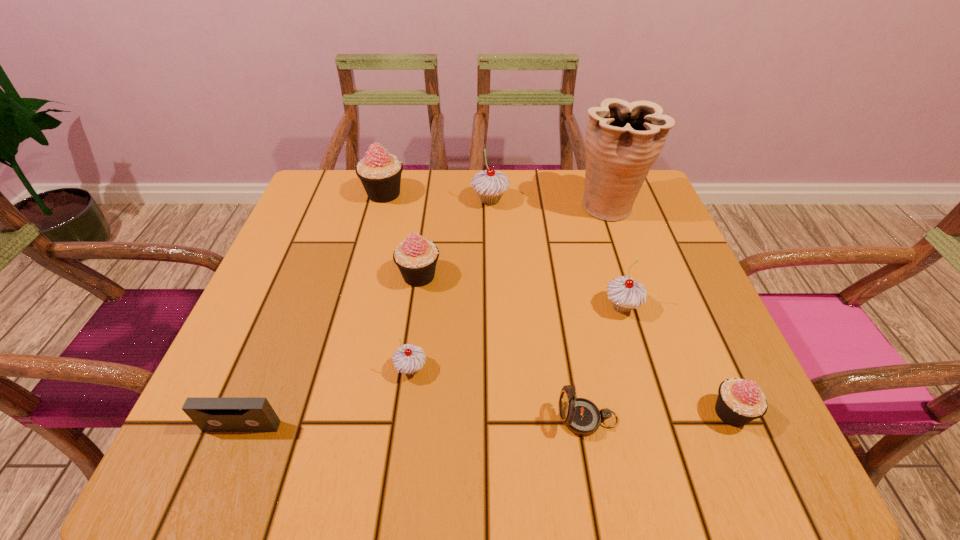
The height and width of the screenshot is (540, 960). Find the location of `free location at the left edge`. free location at the left edge is located at coordinates (297, 234).

I want to click on blank space at the far left corner of the desktop, so click(336, 211).

In the image, there is a desktop. At what (x,y) coordinates should I click in order to perform the action: click on free region at the near left corner. Please return your answer as a coordinate pair (x, y). This screenshot has width=960, height=540. Looking at the image, I should click on (289, 423).

Where is `vacant space at the far right corner of the desktop`? The image size is (960, 540). vacant space at the far right corner of the desktop is located at coordinates (659, 213).

Find the location of `vacant point located between the second nearest pink cupcake and the tallest object`. vacant point located between the second nearest pink cupcake and the tallest object is located at coordinates (514, 241).

Locate an element on the screen. Image resolution: width=960 pixels, height=540 pixels. vacant space that's between the farthest pink cupcake and the fourth nearest cupcake is located at coordinates (401, 235).

Find the location of `vacant space in between the fourth farthest object and the second smallest gray cupcake`. vacant space in between the fourth farthest object and the second smallest gray cupcake is located at coordinates (520, 291).

At what (x,y) coordinates should I click in order to perform the action: click on free spot between the fifth cupcake from left to right and the second nearest cupcake. Please return your answer as a coordinate pair (x, y). This screenshot has height=540, width=960. Looking at the image, I should click on (516, 338).

Image resolution: width=960 pixels, height=540 pixels. Identify the location of vacant area that lies between the tallest object and the fifth farthest object. (615, 256).

Identify the location of vacant area that lies between the shortest object and the fifth farthest cupcake. The height and width of the screenshot is (540, 960). (326, 397).